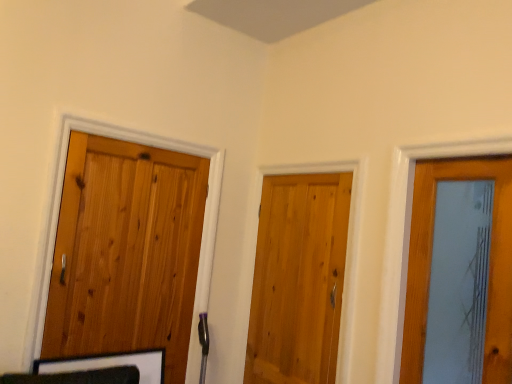
Question: Considering the positions of natural wood door at center, the first door positioned from the right, and natural wood door at left, the 1th door in the left-to-right sequence, in the image, is natural wood door at center, the first door positioned from the right, taller or shorter than natural wood door at left, the 1th door in the left-to-right sequence,?

Choices:
 (A) tall
 (B) short

Answer: (B)

Question: From the image's perspective, is natural wood door at center, the second door viewed from the left, above or below natural wood door at left, the 2th door viewed from the right?

Choices:
 (A) above
 (B) below

Answer: (B)

Question: Choose the correct answer: Is natural wood door at center, the first door positioned from the right, inside natural wood door at left, the 2th door viewed from the right, or outside it?

Choices:
 (A) inside
 (B) outside

Answer: (B)

Question: Is point (92, 332) closer or farther from the camera than point (272, 288)?

Choices:
 (A) closer
 (B) farther

Answer: (A)

Question: From a real-world perspective, is natural wood door at left, the 2th door viewed from the right, positioned above or below natural wood door at center, the first door positioned from the right?

Choices:
 (A) below
 (B) above

Answer: (B)

Question: Considering their positions, is natural wood door at left, the 2th door viewed from the right, located in front of or behind natural wood door at center, the second door viewed from the left?

Choices:
 (A) front
 (B) behind

Answer: (A)

Question: From the image's perspective, relative to natural wood door at center, the second door viewed from the left, is natural wood door at left, the 1th door in the left-to-right sequence, above or below?

Choices:
 (A) below
 (B) above

Answer: (B)